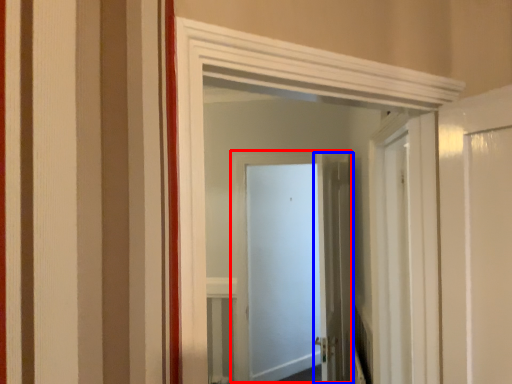
Question: Which object is further to the camera taking this photo, door (highlighted by a red box) or door (highlighted by a blue box)?

Choices:
 (A) door
 (B) door

Answer: (A)